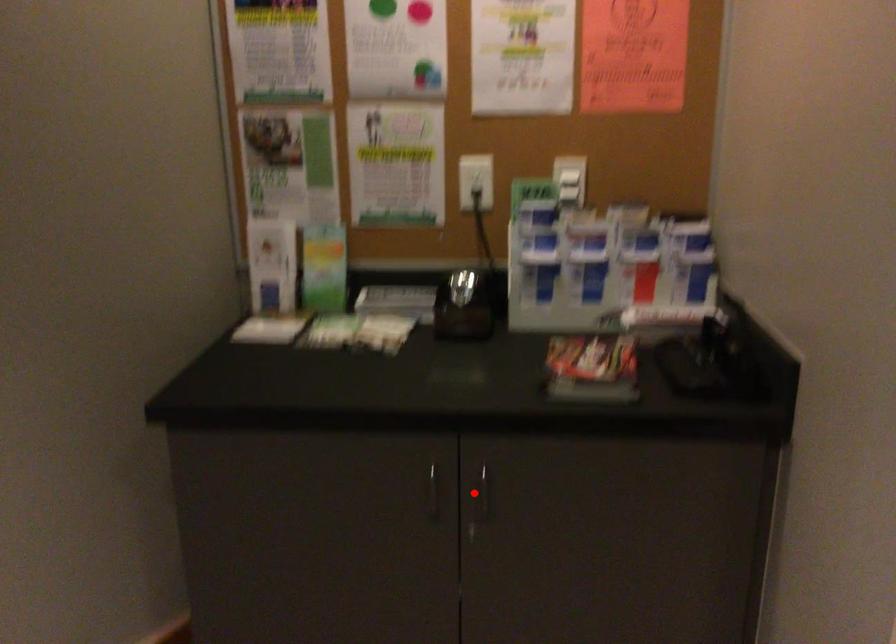
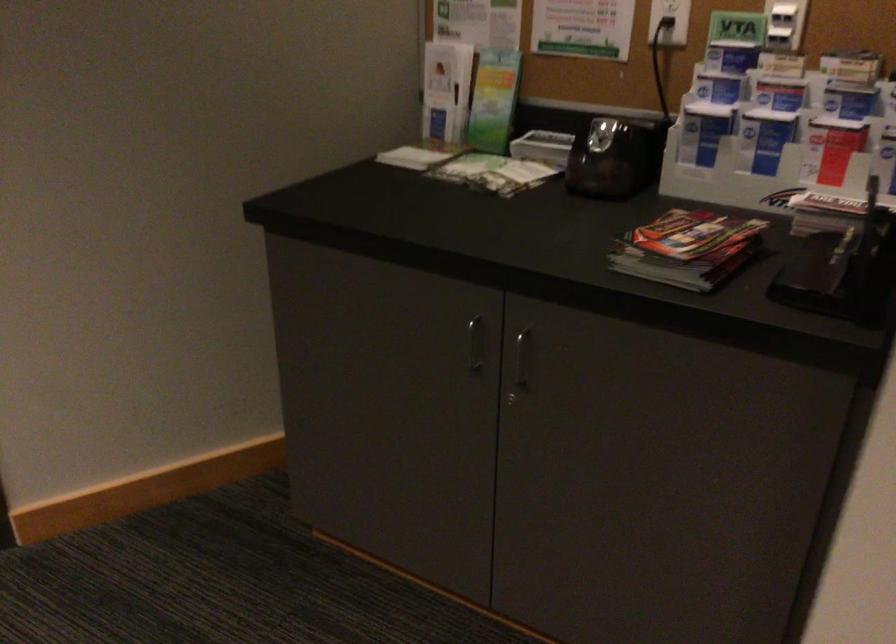
Find the pixel in the second image that matches the highlighted location in the first image.

(521, 357)